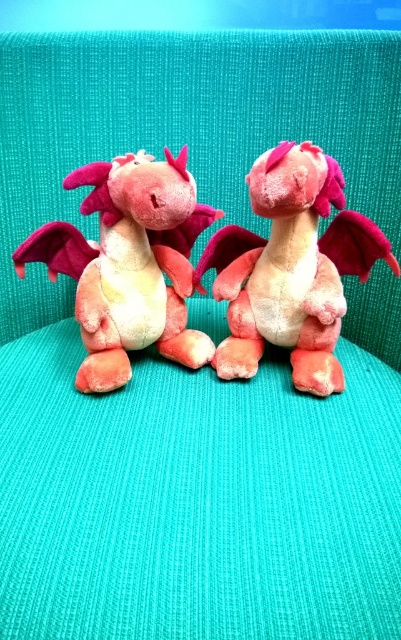
From the picture: You are a child who wants to place a new dragon toy between the velvet pink plush dragon at center and the velvet pink dragon at left. The new dragon is 3.5 inches wide. Is there enough space between them to fit the new dragon?

The velvet pink plush dragon at center and the velvet pink dragon at left are 7.20 inches apart, so yes, there is enough space to fit a 3.5 inch wide dragon between them.

You are a toy organizer trying to place a new dragon toy exactly where the velvet pink plush dragon at center is currently located. According to the image, what are the exact coordinates where you should place the new dragon toy?

The velvet pink plush dragon at center is located at coordinates point (291,268), so you should place the new dragon toy at point (291,268).

You are a child who is 3 feet tall and standing in front of the velvet pink plush dragon at center. Can you reach the dragon to give it a hug?

The velvet pink plush dragon at center and viewer are 3.65 feet apart from each other, so the child who is 3 feet tall cannot reach the dragon to give it a hug because the distance is greater than their height.